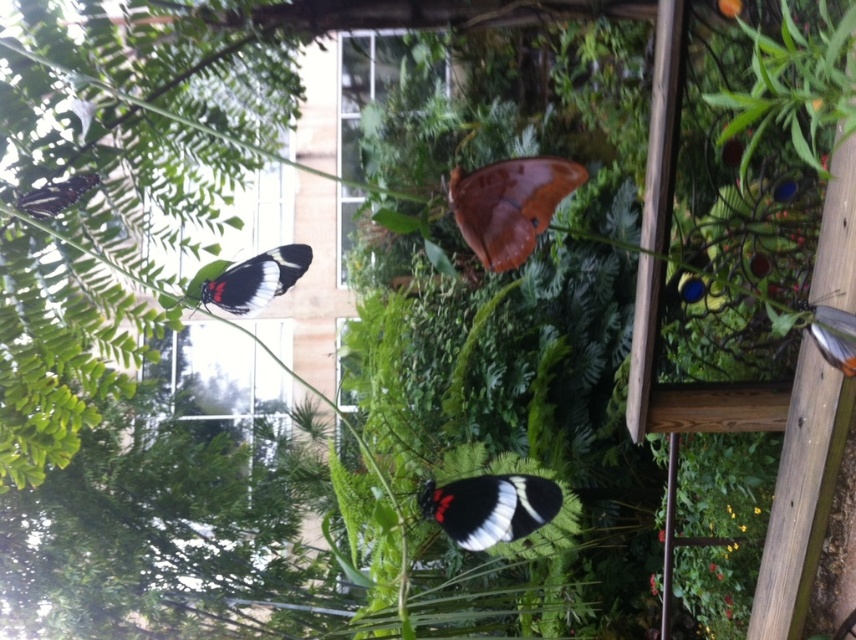
Question: Considering the relative positions of brown matte butterfly at upper center and matte black butterfly at upper left in the image provided, where is brown matte butterfly at upper center located with respect to matte black butterfly at upper left?

Choices:
 (A) below
 (B) above

Answer: (A)

Question: Which of the following is the farthest from the observer?

Choices:
 (A) (545, 163)
 (B) (509, 538)
 (C) (39, 216)
 (D) (259, 301)

Answer: (D)

Question: Is brown matte butterfly at upper center thinner than matte black butterfly at upper left?

Choices:
 (A) yes
 (B) no

Answer: (B)

Question: Which object is positioned closest to the translucent white butterfly at upper right?

Choices:
 (A) black and white winged insect at center
 (B) black matte butterfly at upper left
 (C) brown matte butterfly at upper center

Answer: (C)

Question: Estimate the real-world distances between objects in this image. Which object is farther from the translucent white butterfly at upper right?

Choices:
 (A) black and white winged insect at center
 (B) brown matte butterfly at upper center
 (C) black matte butterfly at upper left

Answer: (C)

Question: Is black and white winged insect at center closer to camera compared to matte black butterfly at upper left?

Choices:
 (A) yes
 (B) no

Answer: (B)